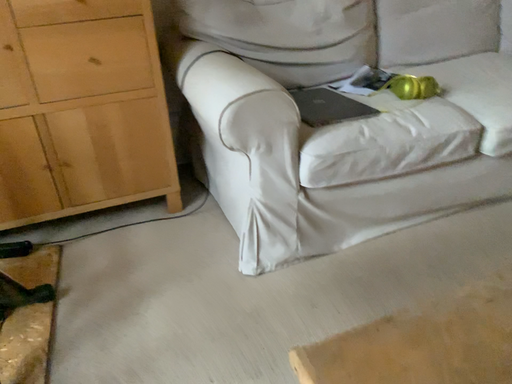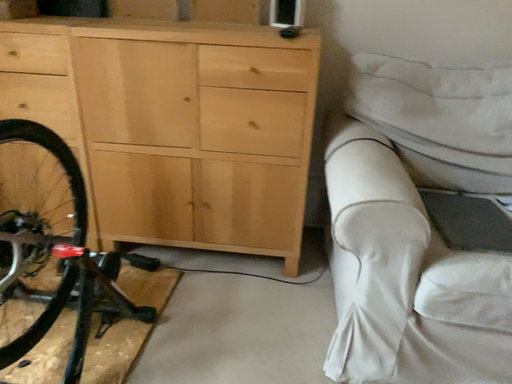
Question: Which way did the camera rotate in the video?

Choices:
 (A) rotated upward
 (B) rotated downward

Answer: (A)